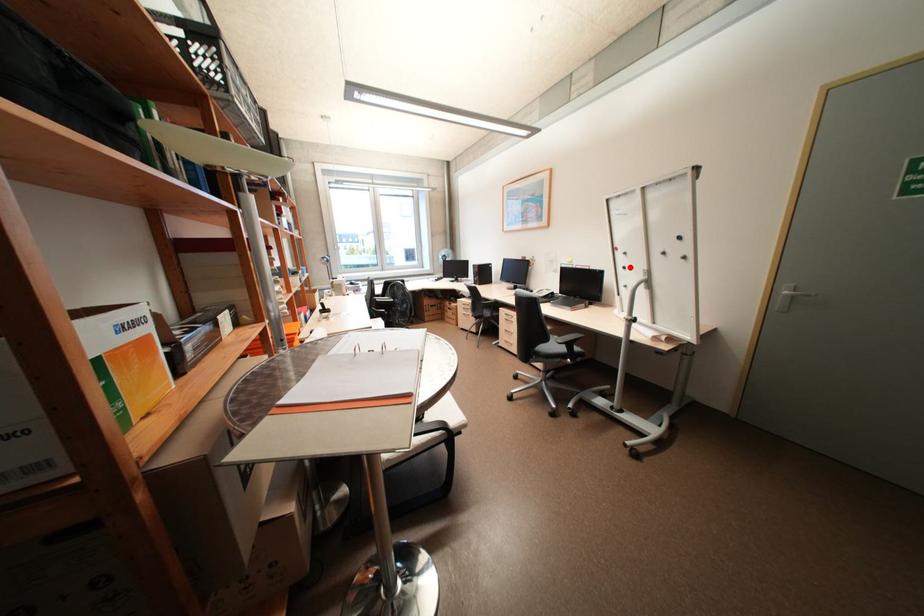
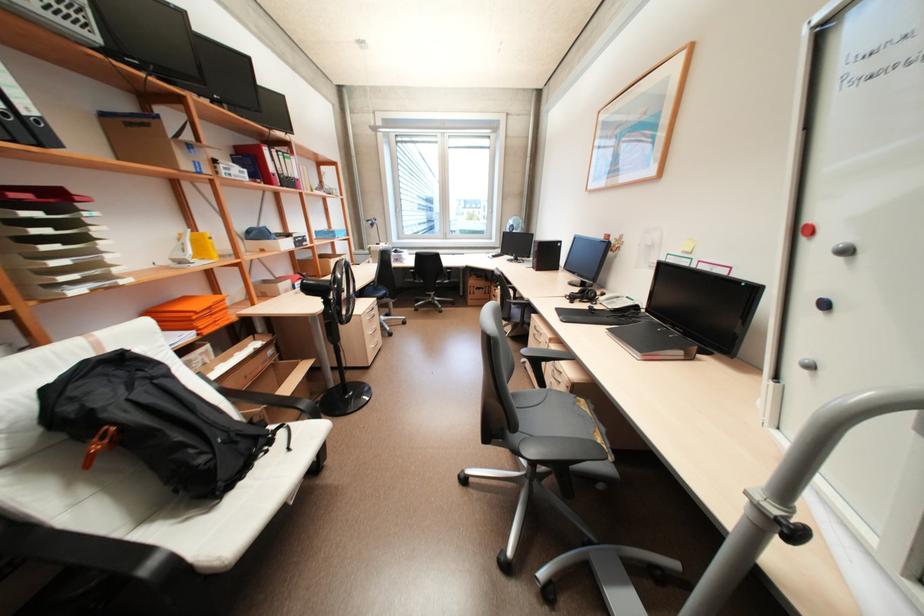
The point at the highlighted location is marked in the first image. Where is the corresponding point in the second image?

(830, 304)